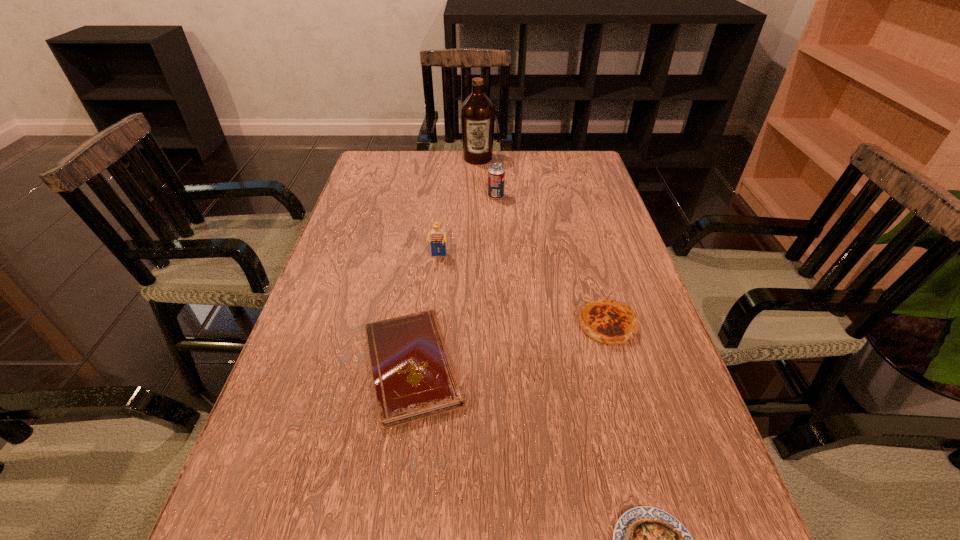
The height and width of the screenshot is (540, 960). I want to click on free space located 0.160m on the left of the farther quiche, so click(502, 325).

At what (x,y) coordinates should I click in order to perform the action: click on free spot located on the back of the notebook. Please return your answer as a coordinate pair (x, y). Looking at the image, I should click on (432, 224).

Find the location of `object at the far edge`. object at the far edge is located at coordinates (477, 112).

The width and height of the screenshot is (960, 540). Find the location of `object located at the left edge`. object located at the left edge is located at coordinates (413, 375).

You are a GUI agent. You are given a task and a screenshot of the screen. Output one action in this format:
    pyautogui.click(x=<x>, y=<y>)
    Task: Click on the object positioned at the right edge
    
    Given the screenshot: What is the action you would take?
    point(607,321)

The height and width of the screenshot is (540, 960). In order to click on free space at the far edge of the desktop in this screenshot , I will do `click(435, 165)`.

Find the location of a particular element. This screenshot has width=960, height=540. free region at the left edge of the desktop is located at coordinates (348, 355).

In the image, there is a desktop. At what (x,y) coordinates should I click in order to perform the action: click on free space at the right edge. Please return your answer as a coordinate pair (x, y). The width and height of the screenshot is (960, 540). Looking at the image, I should click on (722, 490).

In the image, there is a desktop. In order to click on vacant space at the far left corner in this screenshot , I will do `click(409, 161)`.

Image resolution: width=960 pixels, height=540 pixels. I want to click on vacant space at the far right corner, so click(589, 172).